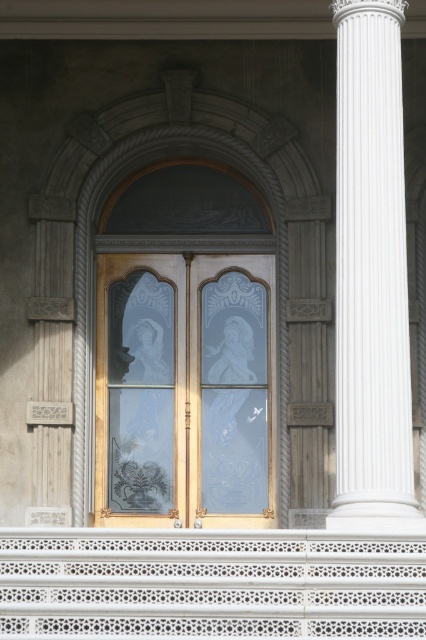
You are standing in front of the building facade and want to locate the point at coordinates (184, 388). According to the image description, where is this point located?

The point at coordinates (184, 388) is located on the clear glass window at center.

In the scene shown: You are an architect designing a new building and want to ensure accessibility for wheelchair users. The clear glass window at center and the white lace balustrade at lower center are part of the design. Considering their heights, which object might pose a challenge for someone in a wheelchair to see over or under?

The clear glass window at center has a greater height compared to the white lace balustrade at lower center. Therefore, the clear glass window at center may pose a challenge for wheelchair users to see over due to its greater height, while the lower height of the white lace balustrade at lower center might allow for better visibility under it.

You are standing in front of the building and want to compare the height of the white lace balustrade at lower center and the white marble column at right. Which one is taller?

The white marble column at right is taller than the white lace balustrade at lower center.